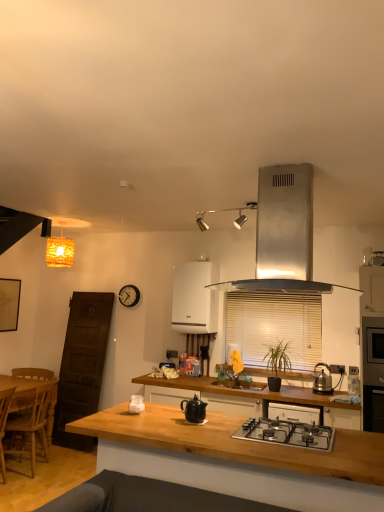
Locate an element on the screen. The height and width of the screenshot is (512, 384). wooden countertop at center is located at coordinates (243, 391).

Image resolution: width=384 pixels, height=512 pixels. Identify the location of wooden chair at left. (32, 414).

Where is `satin silver range hood at upper center, the 1th kitchen appliance from the top`? This screenshot has width=384, height=512. satin silver range hood at upper center, the 1th kitchen appliance from the top is located at coordinates (283, 233).

How much space does satin silver range hood at upper center, the 1th kitchen appliance from the top, occupy horizontally?

satin silver range hood at upper center, the 1th kitchen appliance from the top, is 21.49 inches in width.

Measure the distance between point (190,297) and camera.

Point (190,297) and camera are 4.53 meters apart.

You are a GUI agent. You are given a task and a screenshot of the screen. Output one action in this format:
    pyautogui.click(x=<x>, y=<y>)
    Task: Click on the white glossy wall oven at center, acting as the 4th kitchen appliance starting from the bottom
    Image resolution: width=384 pixels, height=512 pixels.
    Given the screenshot: What is the action you would take?
    pyautogui.click(x=195, y=298)

Where is `white glossy jar at center, the first kitchen appliance in the left-to-right sequence`? white glossy jar at center, the first kitchen appliance in the left-to-right sequence is located at coordinates (136, 404).

Locate an element on the screen. The image size is (384, 512). wooden clock at upper left is located at coordinates (129, 295).

Between white glossy jar at center, the third kitchen appliance when ordered from front to back, and wooden clock at upper left, which one has less height?

With less height is white glossy jar at center, the third kitchen appliance when ordered from front to back.

Considering the points (140, 402) and (125, 298), which point is behind, point (140, 402) or point (125, 298)?

The point (125, 298) is farther.

Is white glossy jar at center, which ranks as the 5th kitchen appliance in right-to-left order, far away from wooden clock at upper left?

That's right, there is a large distance between white glossy jar at center, which ranks as the 5th kitchen appliance in right-to-left order, and wooden clock at upper left.

What's the angular difference between white glossy jar at center, which ranks as the 5th kitchen appliance in right-to-left order, and wooden clock at upper left's facing directions?

The facing directions of white glossy jar at center, which ranks as the 5th kitchen appliance in right-to-left order, and wooden clock at upper left are 179 degrees apart.

Which object is further away from the camera, black ceramic teapot at center, placed as the third kitchen appliance when sorted from bottom to top, or black stainless steel oven at right?

Positioned behind is black stainless steel oven at right.

From the image's perspective, count 1st kitchen appliances downward from the black stainless steel oven at right and point to it. Please provide its 2D coordinates.

[(194, 410)]

Who is shorter, black ceramic teapot at center, placed as the third kitchen appliance when sorted from bottom to top, or black stainless steel oven at right?

Standing shorter between the two is black ceramic teapot at center, placed as the third kitchen appliance when sorted from bottom to top.

Which of these two, black ceramic teapot at center, which is the fourth kitchen appliance in right-to-left order, or black stainless steel oven at right, is smaller?

Smaller between the two is black ceramic teapot at center, which is the fourth kitchen appliance in right-to-left order.

Can you see wooden at center touching stainless steel gas stove at center?

They are not placed beside each other.

Is wooden at center taller or shorter than stainless steel gas stove at center?

Clearly, wooden at center is taller compared to stainless steel gas stove at center.

From the picture: What's the angular difference between wooden at center and stainless steel gas stove at center's facing directions?

0.000241 degrees.

Considering the relative positions of wooden at center and stainless steel gas stove at center in the image provided, is wooden at center to the right of stainless steel gas stove at center from the viewer's perspective?

No, wooden at center is not to the right of stainless steel gas stove at center.

Which object is more forward, wooden chair at left or wooden at center?

wooden at center is in front.

How many degrees apart are the facing directions of wooden chair at left and wooden at center?

The facing directions of wooden chair at left and wooden at center are 90.7 degrees apart.

From a real-world perspective, which is physically above, wooden chair at left or wooden at center?

In real-world perspective, wooden at center is above.

In the scene shown: Is wooden chair at left wider or thinner than wooden at center?

Clearly, wooden chair at left has more width compared to wooden at center.

Which is behind, point (72, 253) or point (227, 310)?

The point (72, 253) is more distant.

Is orange woven lampshade at upper left aimed at white blinds at center?

No.

Which is more to the left, orange woven lampshade at upper left or white blinds at center?

Positioned to the left is orange woven lampshade at upper left.

Who is bigger, orange woven lampshade at upper left or white blinds at center?

white blinds at center is bigger.

From the image's perspective, which one is positioned lower, black stainless steel oven at right or white blinds at center?

black stainless steel oven at right.

Can you see black stainless steel oven at right touching white blinds at center?

No, black stainless steel oven at right is not touching white blinds at center.

Between black stainless steel oven at right and white blinds at center, which one has larger size?

black stainless steel oven at right.

Which is behind, point (300, 402) or point (135, 400)?

The point (300, 402) is more distant.

Which object is further away from the camera taking this photo, wooden countertop at center or white glossy jar at center, which ranks as the 5th kitchen appliance in right-to-left order?

wooden countertop at center is behind.

Looking at their sizes, would you say wooden countertop at center is wider or thinner than white glossy jar at center, arranged as the 3th kitchen appliance when viewed from the back?

In the image, wooden countertop at center appears to be wider than white glossy jar at center, arranged as the 3th kitchen appliance when viewed from the back.

Image resolution: width=384 pixels, height=512 pixels. What are the coordinates of `clock that appears above the white glossy jar at center, the 4th kitchen appliance in the top-to-bottom sequence (from a real-world perspective)` in the screenshot? It's located at click(129, 295).

The width and height of the screenshot is (384, 512). Identify the location of kitchen appliance that is the 4th one when counting leftward from the black stainless steel oven at right. (194, 410).

From the image, which object appears to be nearer to wooden chair at left, wooden countertop at center or white glossy jar at center, the 4th kitchen appliance in the top-to-bottom sequence?

Based on the image, wooden countertop at center appears to be nearer to wooden chair at left.

Based on the photo, when comparing their distances from wooden chair at left, does orange woven lampshade at upper left or shiny metallic kettle at center, positioned as the fifth kitchen appliance in top-to-bottom order, seem closer?

orange woven lampshade at upper left.

Looking at the image, which one is located closer to white glossy jar at center, the 4th kitchen appliance in the top-to-bottom sequence, white glossy wall oven at center, marked as the 2th kitchen appliance in a top-to-bottom arrangement, or wooden at center?

wooden at center is positioned closer to the anchor white glossy jar at center, the 4th kitchen appliance in the top-to-bottom sequence.

In the scene shown: Estimate the real-world distances between objects in this image. Which object is further from white glossy jar at center, which ranks as the 5th kitchen appliance in right-to-left order, white blinds at center or orange woven lampshade at upper left?

orange woven lampshade at upper left.

Looking at the image, which one is located further to wooden chair at left, wooden clock at upper left or wooden at center?

wooden at center is further to wooden chair at left.

From the image, which object appears to be nearer to stainless steel gas stove at center, orange woven lampshade at upper left or wooden clock at upper left?

wooden clock at upper left.

Consider the image. When comparing their distances from wooden chair at left, does stainless steel gas stove at center or white blinds at center seem further?

The object further to wooden chair at left is stainless steel gas stove at center.

Considering their positions, is white glossy jar at center, the first kitchen appliance in the left-to-right sequence, positioned further to white glossy wall oven at center, acting as the fifth kitchen appliance starting from the front, than white blinds at center?

The object further to white glossy wall oven at center, acting as the fifth kitchen appliance starting from the front, is white glossy jar at center, the first kitchen appliance in the left-to-right sequence.

At what (x,y) coordinates should I click in order to perform the action: click on window screen between white glossy jar at center, which ranks as the 5th kitchen appliance in right-to-left order, and shiny metallic kettle at center, which ranks as the 4th kitchen appliance in front-to-back order, from left to right. Please return your answer as a coordinate pair (x, y). Looking at the image, I should click on (274, 326).

Find the location of a particular element. gas stove located between wooden chair at left and black stainless steel oven at right in the left-right direction is located at coordinates (287, 433).

Find the location of a particular element. The height and width of the screenshot is (512, 384). clock situated between wooden chair at left and white blinds at center from left to right is located at coordinates (129, 295).

Identify the location of chair positioned between black ceramic teapot at center, placed as the third kitchen appliance when sorted from bottom to top, and wooden clock at upper left from near to far. The image size is (384, 512). (32, 414).